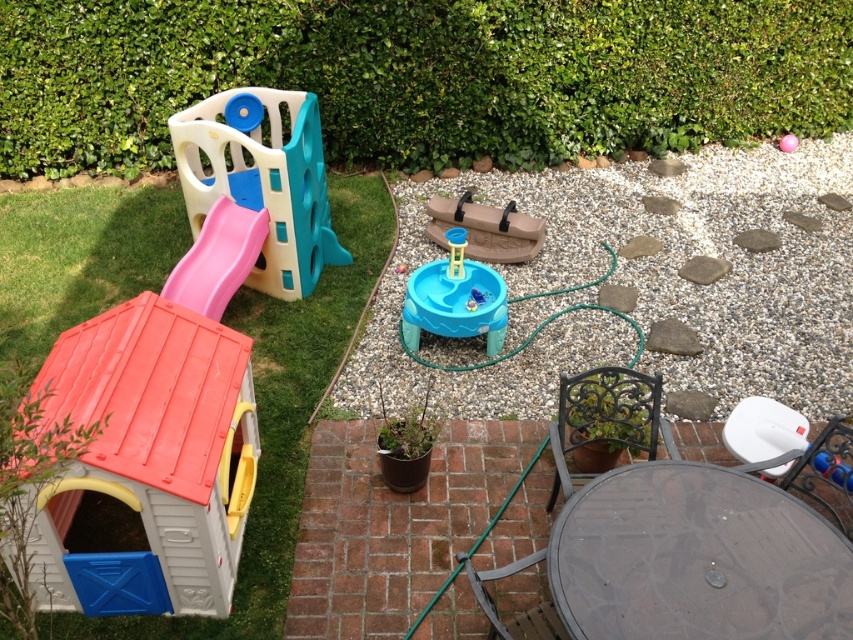
You are a parent setting up a play area for children. You want to place a small potted plant between the black wrought iron chair at lower right and the blue plastic water table at center. Based on their positions, which side of the water table should you place the plant to ensure it stays within the play area?

The black wrought iron chair at lower right is to the right of the blue plastic water table at center, so placing the plant between them would require positioning it to the right side of the water table, near the chair, to keep it within the play area.

Based on the photo, you are a parent setting up a play area for your child. You have a plastic playhouse at left and a black wrought iron chair at lower right. Which object should you place closer to the entrance if you want the playhouse to be more accessible to visitors entering from the left side?

The plastic playhouse at left is positioned on the left side of black wrought iron chair at lower right, so placing it closer to the entrance would make it more accessible to visitors entering from the left side.

You are a child trying to reach the black wrought iron chair at lower right from the plastic playhouse at left. Which direction should you move to get there?

The plastic playhouse at left is below the black wrought iron chair at lower right, so you should move upward to reach the black wrought iron chair at lower right from the plastic playhouse at left.